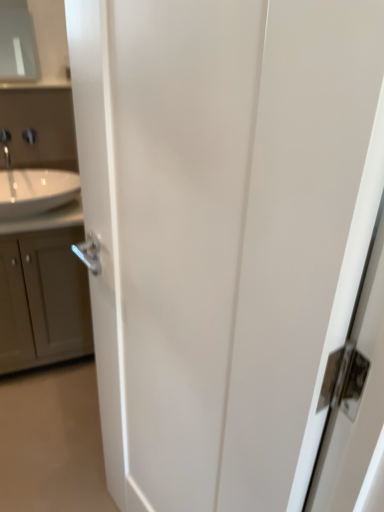
In order to face satin nickel faucet at upper left, should I rotate leftwards or rightwards?

You should rotate left by 20.590 degrees.

I want to click on satin nickel faucet at upper left, so click(29, 136).

At what (x,y) coordinates should I click in order to perform the action: click on white glossy sink at left. Please return your answer as a coordinate pair (x, y). The height and width of the screenshot is (512, 384). Looking at the image, I should click on (33, 188).

Find the location of a particular element. Image resolution: width=384 pixels, height=512 pixels. medicine cabinet above the white glossy sink at left (from the image's perspective) is located at coordinates (17, 42).

Does white glossy sink at left come in front of matte gray medicine cabinet at upper left?

Yes, white glossy sink at left is closer to the camera.

From a real-world perspective, between white glossy sink at left and matte gray medicine cabinet at upper left, who is vertically higher?

In real-world perspective, matte gray medicine cabinet at upper left is above.

Is white glossy sink at left oriented towards matte gray cabinet at left?

No, white glossy sink at left does not turn towards matte gray cabinet at left.

From the picture: Does white glossy sink at left have a smaller size compared to matte gray cabinet at left?

Yes, white glossy sink at left is smaller than matte gray cabinet at left.

Is there a large distance between white glossy sink at left and matte gray cabinet at left?

They are positioned close to each other.

Does white glossy sink at left contain matte gray cabinet at left?

No, matte gray cabinet at left is located outside of white glossy sink at left.

From the image's perspective, between matte gray medicine cabinet at upper left and silver metallic tap at upper left, who is located below?

From the image's view, silver metallic tap at upper left is below.

Consider the image. Is matte gray medicine cabinet at upper left positioned with its back to silver metallic tap at upper left?

No, silver metallic tap at upper left is not at the back of matte gray medicine cabinet at upper left.

At what (x,y) coordinates should I click in order to perform the action: click on tap located on the right of matte gray medicine cabinet at upper left. Please return your answer as a coordinate pair (x, y). The image size is (384, 512). Looking at the image, I should click on (6, 146).

Considering the sizes of objects matte gray medicine cabinet at upper left and silver metallic tap at upper left in the image provided, who is taller, matte gray medicine cabinet at upper left or silver metallic tap at upper left?

matte gray medicine cabinet at upper left.

Locate an element on the screen. The image size is (384, 512). tap above the white glossy sink at left (from a real-world perspective) is located at coordinates (6, 146).

Considering the positions of objects white glossy sink at left and silver metallic tap at upper left in the image provided, who is more to the right, white glossy sink at left or silver metallic tap at upper left?

Positioned to the right is white glossy sink at left.

Is white glossy sink at left aimed at silver metallic tap at upper left?

No, white glossy sink at left is not facing towards silver metallic tap at upper left.

Considering the positions of points (13, 179) and (3, 146), is point (13, 179) farther from camera compared to point (3, 146)?

That is True.

Considering the points (14, 67) and (32, 130), which point is behind, point (14, 67) or point (32, 130)?

The point (14, 67) is farther.

Locate an element on the screen. The image size is (384, 512). faucet located on the right of matte gray medicine cabinet at upper left is located at coordinates (29, 136).

Does matte gray medicine cabinet at upper left come in front of satin nickel faucet at upper left?

Yes, matte gray medicine cabinet at upper left is in front of satin nickel faucet at upper left.

How many degrees apart are the facing directions of matte gray medicine cabinet at upper left and satin nickel faucet at upper left?

The angular difference between matte gray medicine cabinet at upper left and satin nickel faucet at upper left is 0.278 degrees.

Would you say matte gray medicine cabinet at upper left is part of silver metallic tap at upper left's contents?

A: No.

Considering the positions of objects silver metallic tap at upper left and matte gray medicine cabinet at upper left in the image provided, who is behind, silver metallic tap at upper left or matte gray medicine cabinet at upper left?

matte gray medicine cabinet at upper left is behind.

Based on the photo, would you say silver metallic tap at upper left is a long distance from matte gray medicine cabinet at upper left?

Yes.

Are matte gray cabinet at left and silver metallic tap at upper left far apart?

No.

Measure the distance from matte gray cabinet at left to silver metallic tap at upper left.

24.96 inches.

Could you tell me if matte gray cabinet at left is turned towards silver metallic tap at upper left?

No, matte gray cabinet at left is not aimed at silver metallic tap at upper left.

From the picture: Choose the correct answer: Is matte gray cabinet at left inside silver metallic tap at upper left or outside it?

matte gray cabinet at left is spatially situated outside silver metallic tap at upper left.

The image size is (384, 512). I want to click on sink that is on the right side of matte gray medicine cabinet at upper left, so click(x=33, y=188).

The height and width of the screenshot is (512, 384). In the image, there is a matte gray cabinet at left. In order to click on sink above it (from the image's perspective) in this screenshot , I will do click(x=33, y=188).

From the image, which object appears to be farther from matte gray medicine cabinet at upper left, white glossy sink at left or silver metallic tap at upper left?

white glossy sink at left is further to matte gray medicine cabinet at upper left.

Considering their positions, is matte gray medicine cabinet at upper left positioned further to white glossy sink at left than satin nickel faucet at upper left?

matte gray medicine cabinet at upper left.

From the image, which object appears to be nearer to matte gray cabinet at left, satin nickel faucet at upper left or silver metallic tap at upper left?

silver metallic tap at upper left is closer to matte gray cabinet at left.

Looking at the image, which one is located closer to satin nickel faucet at upper left, white glossy sink at left or silver metallic tap at upper left?

The object closer to satin nickel faucet at upper left is silver metallic tap at upper left.

When comparing their distances from white glossy sink at left, does silver metallic tap at upper left or satin nickel faucet at upper left seem further?

The object further to white glossy sink at left is satin nickel faucet at upper left.

Looking at the image, which one is located further to matte gray medicine cabinet at upper left, white glossy sink at left or satin nickel faucet at upper left?

white glossy sink at left is further to matte gray medicine cabinet at upper left.

Which object lies nearer to the anchor point matte gray cabinet at left, matte gray medicine cabinet at upper left or silver metallic tap at upper left?

silver metallic tap at upper left is positioned closer to the anchor matte gray cabinet at left.

Estimate the real-world distances between objects in this image. Which object is closer to silver metallic tap at upper left, satin nickel faucet at upper left or matte gray cabinet at left?

satin nickel faucet at upper left is positioned closer to the anchor silver metallic tap at upper left.

This screenshot has height=512, width=384. Find the location of `tap between satin nickel faucet at upper left and matte gray cabinet at left from top to bottom`. tap between satin nickel faucet at upper left and matte gray cabinet at left from top to bottom is located at coordinates (6, 146).

Locate an element on the screen. The image size is (384, 512). sink that lies between matte gray medicine cabinet at upper left and matte gray cabinet at left from top to bottom is located at coordinates (33, 188).

Locate an element on the screen. sink between silver metallic tap at upper left and matte gray cabinet at left in the vertical direction is located at coordinates (33, 188).

The height and width of the screenshot is (512, 384). Find the location of `tap between matte gray medicine cabinet at upper left and white glossy sink at left in the up-down direction`. tap between matte gray medicine cabinet at upper left and white glossy sink at left in the up-down direction is located at coordinates (6, 146).